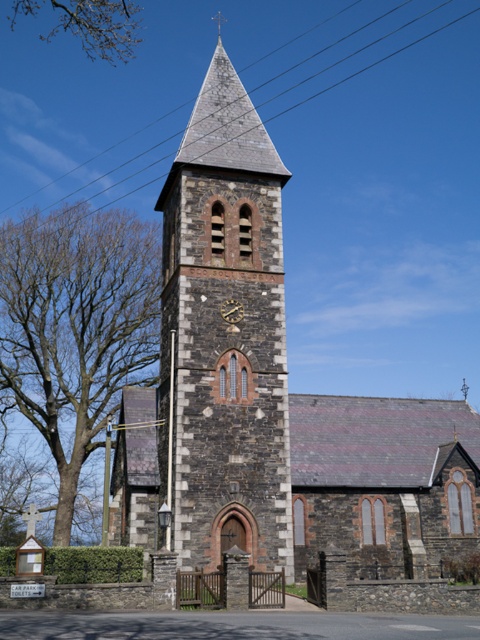
Question: Can you confirm if brown leafless tree at left is thinner than gold textured clock at center?

Choices:
 (A) no
 (B) yes

Answer: (A)

Question: Does metallic wire at upper center come behind brown leafless tree at left?

Choices:
 (A) yes
 (B) no

Answer: (A)

Question: Can you confirm if metallic wire at upper center is positioned below brown leafless tree at left?

Choices:
 (A) yes
 (B) no

Answer: (B)

Question: Estimate the real-world distances between objects in this image. Which object is farther from the gold textured clock at center?

Choices:
 (A) brown leafless tree at left
 (B) bare branches at upper left

Answer: (B)

Question: Which object is positioned closest to the brown leafless tree at left?

Choices:
 (A) gold textured clock at center
 (B) dark gray stone clock tower at center
 (C) metallic wire at upper center

Answer: (B)

Question: Which is nearer to the brown leafless tree at left?

Choices:
 (A) dark gray stone church at center
 (B) dark gray stone clock tower at center

Answer: (A)